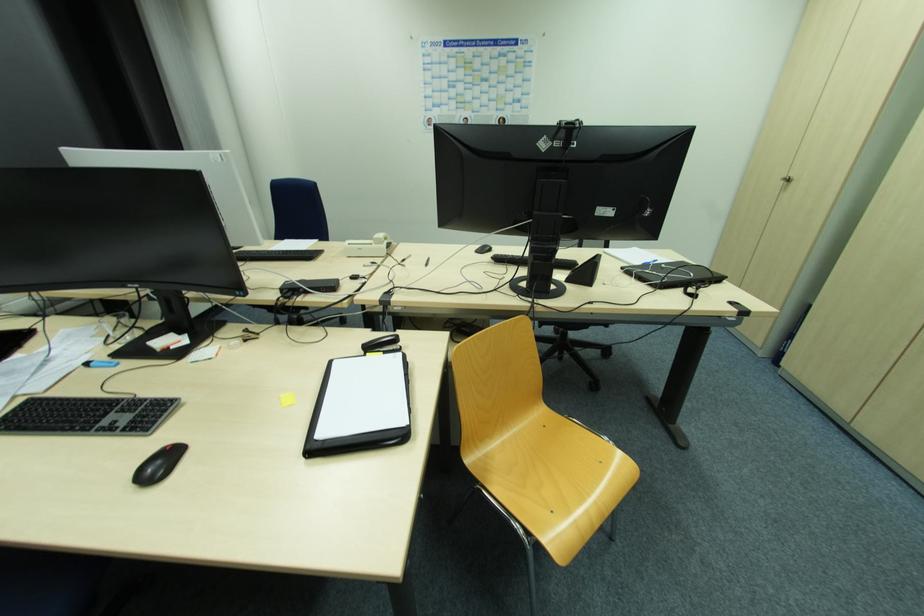
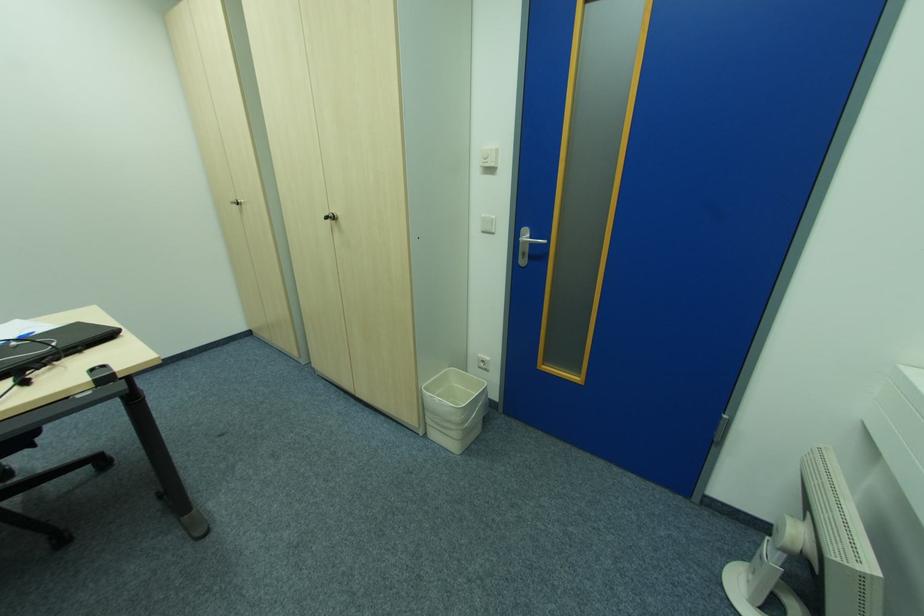
Find the pixel in the second image that matches point (786, 177) in the first image.

(236, 201)